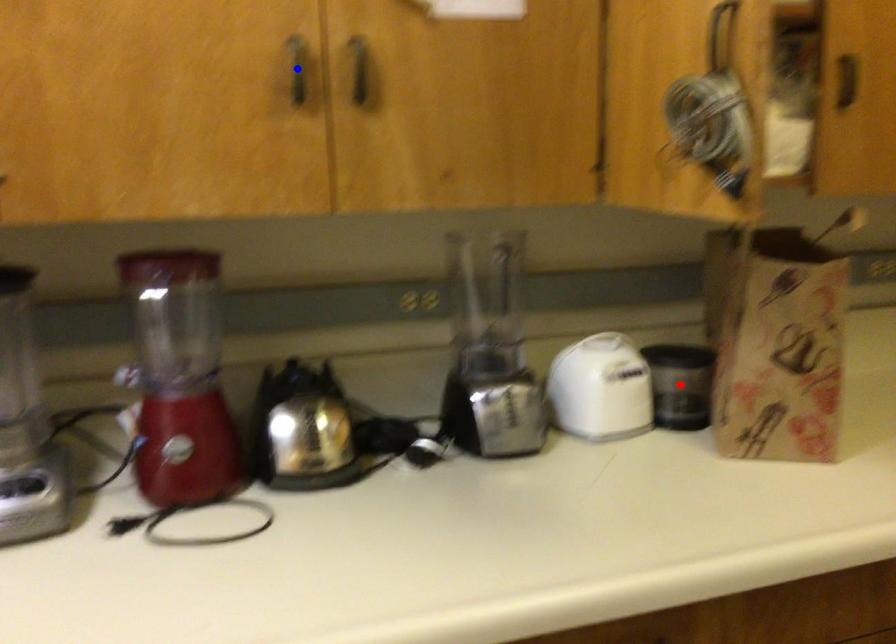
Question: Two points are marked on the image. Which point is closer to the camera?

Choices:
 (A) Blue point is closer.
 (B) Red point is closer.

Answer: (A)